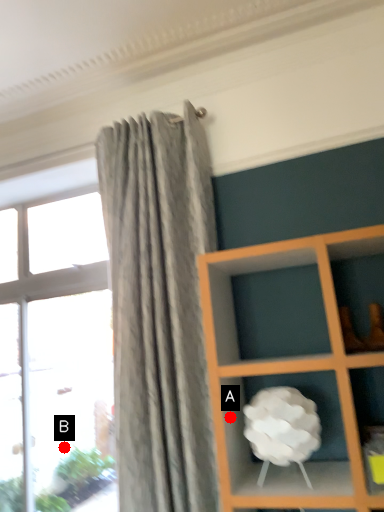
Question: Two points are circled on the image, labeled by A and B beside each circle. Which point is further to the camera?

Choices:
 (A) A is further
 (B) B is further

Answer: (B)